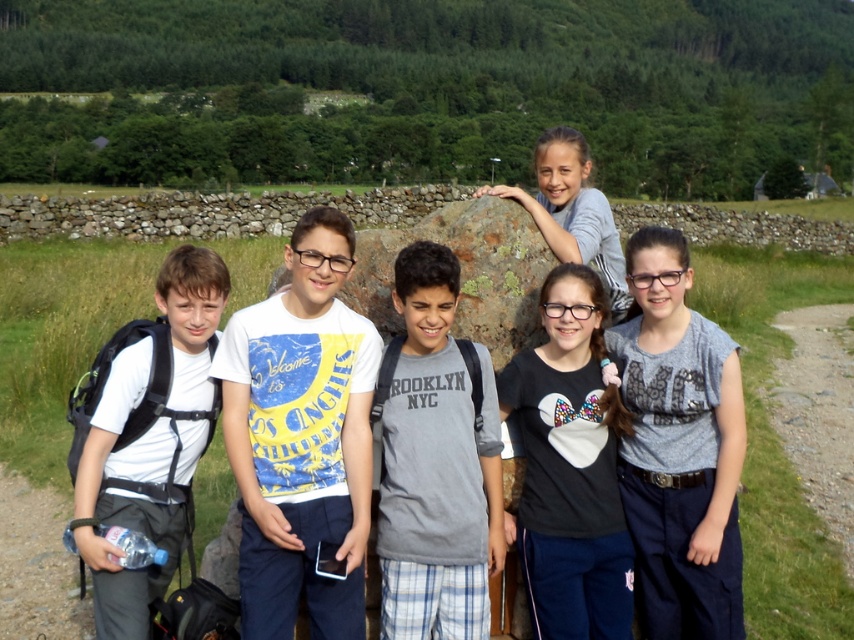
Between gray cotton shirt at center and gray cotton t-shirt at center, which one is positioned higher?

Positioned higher is gray cotton shirt at center.

Does gray cotton shirt at center have a greater height compared to gray cotton t-shirt at center?

Yes.

What do you see at coordinates (679, 448) in the screenshot?
I see `gray cotton shirt at center` at bounding box center [679, 448].

Locate an element on the screen. gray cotton shirt at center is located at coordinates (679, 448).

Where is `gray cotton t-shirt at center`? The height and width of the screenshot is (640, 854). gray cotton t-shirt at center is located at coordinates (436, 461).

Who is more distant from viewer, (416, 310) or (560, 196)?

The point (560, 196) is behind.

Describe the element at coordinates (436, 461) in the screenshot. The width and height of the screenshot is (854, 640). I see `gray cotton t-shirt at center` at that location.

Locate an element on the screen. The height and width of the screenshot is (640, 854). gray cotton t-shirt at center is located at coordinates (436, 461).

Does green mossy rock at center have a lesser width compared to smooth stone boulder at center?

Indeed, green mossy rock at center has a lesser width compared to smooth stone boulder at center.

Does point (358, 300) come in front of point (244, 221)?

Yes, it is.

I want to click on green mossy rock at center, so click(x=463, y=273).